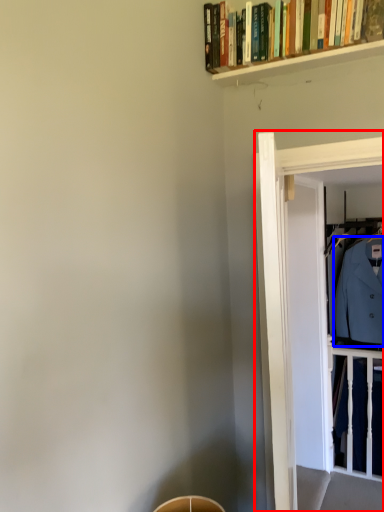
Question: Which object is further to the camera taking this photo, glass door (highlighted by a red box) or dress shirt (highlighted by a blue box)?

Choices:
 (A) glass door
 (B) dress shirt

Answer: (B)